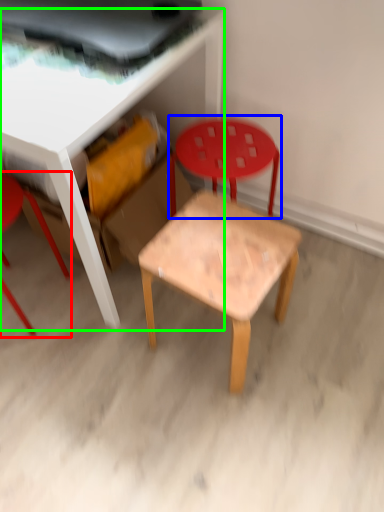
Question: Which object is positioned closest to chair (highlighted by a red box)? Select from chair (highlighted by a blue box) and table (highlighted by a green box).

Choices:
 (A) chair
 (B) table

Answer: (B)